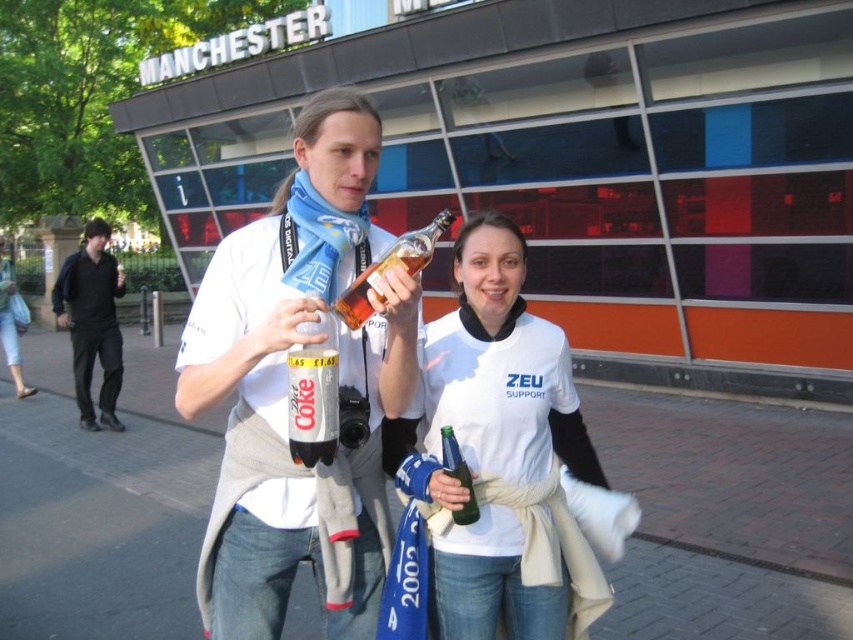
You are a photographer trying to capture a photo of the matte plastic bottle at center and the black cotton jacket at left. From your current position, which object is located to the right of the other?

The matte plastic bottle at center is positioned on the right side of black cotton jacket at left, so the matte plastic bottle at center is to the right of the black cotton jacket at left.

Consider the image. You are a photographer standing at the point where the camera is located in the scene. You want to take a photo of the man on the left holding the bottle and the woman on the right wearing the ZEU SUPPORT shirt. The focus point of your camera is set to the point at coordinates point (x=273, y=294). Will the man and woman be in focus if the depth of field allows objects within 1.5 meters to be sharp?

The point (x=273, y=294) is 1.77 meters from the viewer. Since the depth of field only allows objects within 1.5 meters to be sharp, the man and woman will not be in focus because they are further away than the focus point.

You are a photographer trying to capture a closeup of the matte plastic bottle at center and the white matte shirt at center. Since you want to focus on the details of the bottle, which object should you zoom in on first?

The matte plastic bottle at center has a smaller width than the white matte shirt at center, so you should zoom in on the matte plastic bottle at center first to ensure its details are sharp before adjusting focus on the larger shirt.